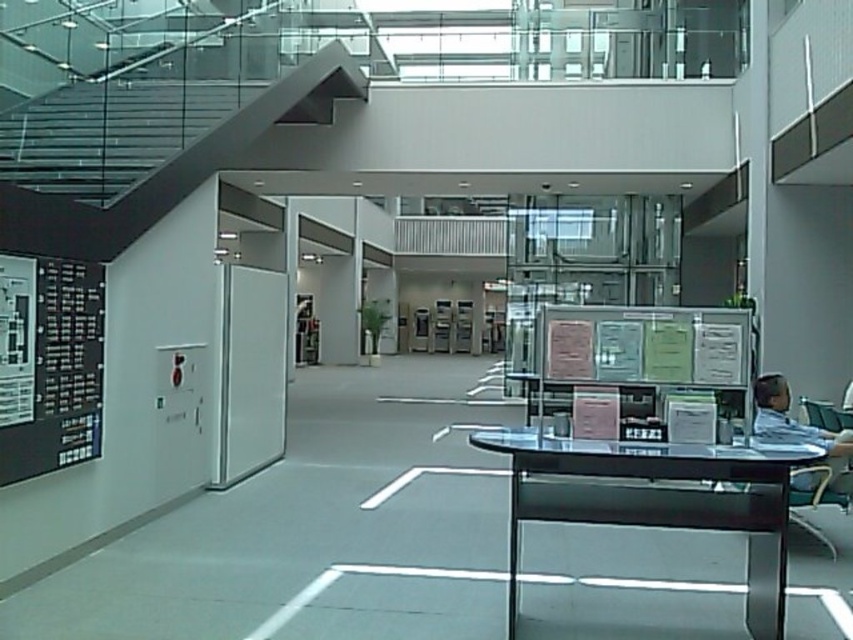
Question: Which point is farther from the camera taking this photo?

Choices:
 (A) (850, 456)
 (B) (90, 376)
 (C) (769, 416)

Answer: (A)

Question: Can you confirm if transparent glass table at center is smaller than metallic silver chair at lower right?

Choices:
 (A) yes
 (B) no

Answer: (B)

Question: Based on their relative distances, which object is nearer to the black matte board at left?

Choices:
 (A) transparent glass table at center
 (B) metallic silver chair at lower right
 (C) light blue shirt at right

Answer: (A)

Question: Is black matte board at left to the right of metallic silver chair at lower right from the viewer's perspective?

Choices:
 (A) yes
 (B) no

Answer: (B)

Question: Does transparent glass table at center come behind metallic silver chair at lower right?

Choices:
 (A) no
 (B) yes

Answer: (A)

Question: Which point is closer to the camera?

Choices:
 (A) (523, 518)
 (B) (844, 452)

Answer: (A)